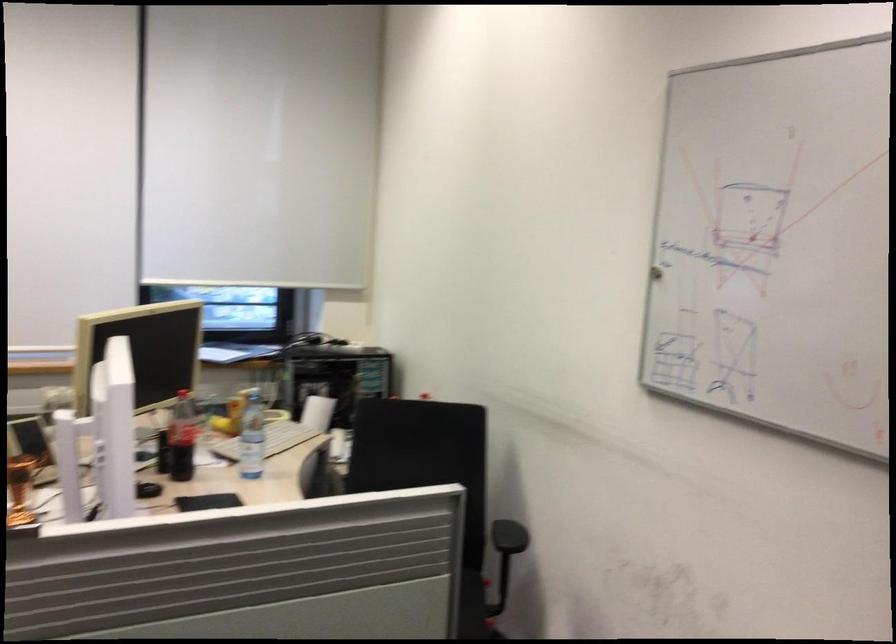
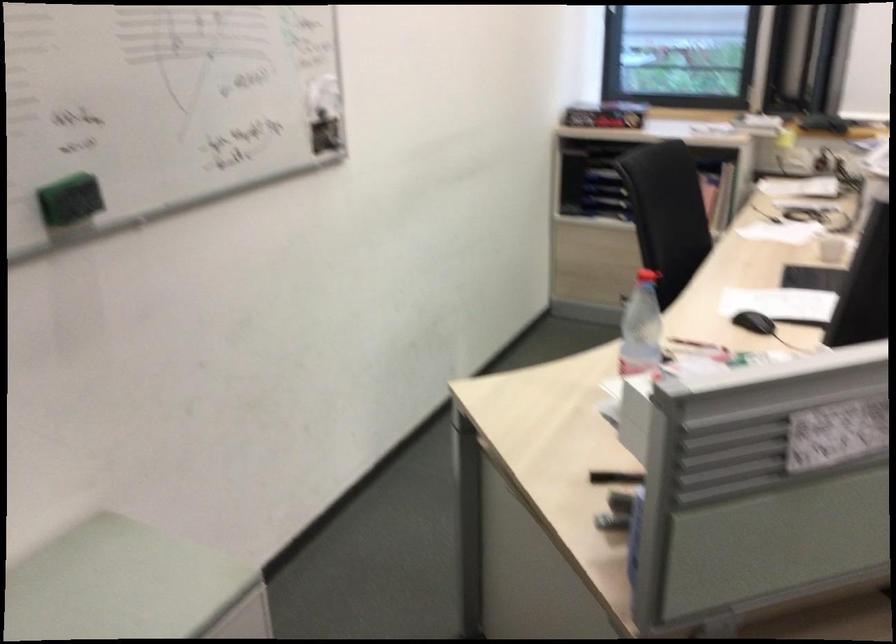
The first image is from the beginning of the video and the second image is from the end. How did the camera likely rotate when shooting the video?

The camera rotated toward left-down.